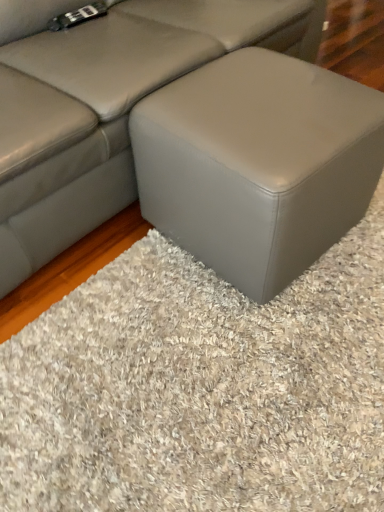
What do you see at coordinates (201, 388) in the screenshot? Image resolution: width=384 pixels, height=512 pixels. I see `gray matte ottoman at center` at bounding box center [201, 388].

The width and height of the screenshot is (384, 512). What do you see at coordinates (258, 164) in the screenshot? I see `matte gray ottoman at center` at bounding box center [258, 164].

Find the location of a particular element. matte gray ottoman at center is located at coordinates (104, 103).

From a real-world perspective, is matte gray ottoman at center physically below gray matte ottoman at center?

No, from a real-world perspective, matte gray ottoman at center is not beneath gray matte ottoman at center.

Between matte gray ottoman at center and gray matte ottoman at center, which one has smaller size?

With smaller size is gray matte ottoman at center.

In order to click on mat on the right of matte gray ottoman at center in this screenshot , I will do `click(201, 388)`.

Consider the image. Is gray matte ottoman at center taller than matte gray ottoman at center?

In fact, gray matte ottoman at center may be shorter than matte gray ottoman at center.

From a real-world perspective, does gray matte ottoman at center sit lower than matte gray ottoman at center?

Correct, in the physical world, gray matte ottoman at center is lower than matte gray ottoman at center.

From the image's perspective, is gray matte ottoman at center above or below matte gray ottoman at center?

gray matte ottoman at center is situated lower than matte gray ottoman at center in the image.

Between point (277, 338) and point (262, 186), which one is positioned behind?

The point (277, 338) is farther from the camera.

Can you confirm if matte gray ottoman at center is thinner than matte gray ottoman at center?

Incorrect, the width of matte gray ottoman at center is not less than that of matte gray ottoman at center.

Could you tell me if matte gray ottoman at center is turned towards matte gray ottoman at center?

Yes, matte gray ottoman at center is facing matte gray ottoman at center.

Considering the relative sizes of matte gray ottoman at center and matte gray ottoman at center in the image provided, is matte gray ottoman at center shorter than matte gray ottoman at center?

Incorrect, the height of matte gray ottoman at center does not fall short of that of matte gray ottoman at center.

Identify the location of studio couch above the matte gray ottoman at center (from a real-world perspective). The image size is (384, 512). (104, 103).

The height and width of the screenshot is (512, 384). What are the coordinates of `mat located on the right of matte gray ottoman at center` in the screenshot? It's located at (201, 388).

Is matte gray ottoman at center not within gray matte ottoman at center?

matte gray ottoman at center is positioned outside gray matte ottoman at center.

Between matte gray ottoman at center and gray matte ottoman at center, which one has smaller width?

Thinner between the two is matte gray ottoman at center.

I want to click on studio couch that appears above the gray matte ottoman at center (from a real-world perspective), so click(x=104, y=103).

From a real-world perspective, which object stands above the other?

matte gray ottoman at center.

Does gray matte ottoman at center have a lesser width compared to matte gray ottoman at center?

Yes, gray matte ottoman at center is thinner than matte gray ottoman at center.

From a real-world perspective, between matte gray ottoman at center and matte gray ottoman at center, who is vertically lower?

matte gray ottoman at center.

Who is bigger, matte gray ottoman at center or matte gray ottoman at center?

With larger size is matte gray ottoman at center.

Is matte gray ottoman at center thinner than matte gray ottoman at center?

Yes.

You are a GUI agent. You are given a task and a screenshot of the screen. Output one action in this format:
    pyautogui.click(x=<x>, y=<y>)
    Task: Click on the studio couch in front of the matte gray ottoman at center
    The height and width of the screenshot is (512, 384).
    Given the screenshot: What is the action you would take?
    pyautogui.click(x=104, y=103)

Identify the location of studio couch on the left of gray matte ottoman at center. (104, 103).

Locate an element on the screen. mat below the matte gray ottoman at center (from a real-world perspective) is located at coordinates (201, 388).

Looking at this image, considering their positions, is gray matte ottoman at center positioned closer to matte gray ottoman at center than matte gray ottoman at center?

matte gray ottoman at center.

Based on their spatial positions, is matte gray ottoman at center or gray matte ottoman at center further from matte gray ottoman at center?

gray matte ottoman at center.

Looking at the image, which one is located further to gray matte ottoman at center, matte gray ottoman at center or matte gray ottoman at center?

The object further to gray matte ottoman at center is matte gray ottoman at center.

Considering their positions, is matte gray ottoman at center positioned closer to matte gray ottoman at center than gray matte ottoman at center?

matte gray ottoman at center is positioned closer to the anchor matte gray ottoman at center.

Looking at the image, which one is located further to matte gray ottoman at center, gray matte ottoman at center or matte gray ottoman at center?

gray matte ottoman at center.

Considering their positions, is matte gray ottoman at center positioned closer to gray matte ottoman at center than matte gray ottoman at center?

The object closer to gray matte ottoman at center is matte gray ottoman at center.

At what (x,y) coordinates should I click in order to perform the action: click on stool between matte gray ottoman at center and gray matte ottoman at center in the up-down direction. Please return your answer as a coordinate pair (x, y). The height and width of the screenshot is (512, 384). Looking at the image, I should click on (258, 164).